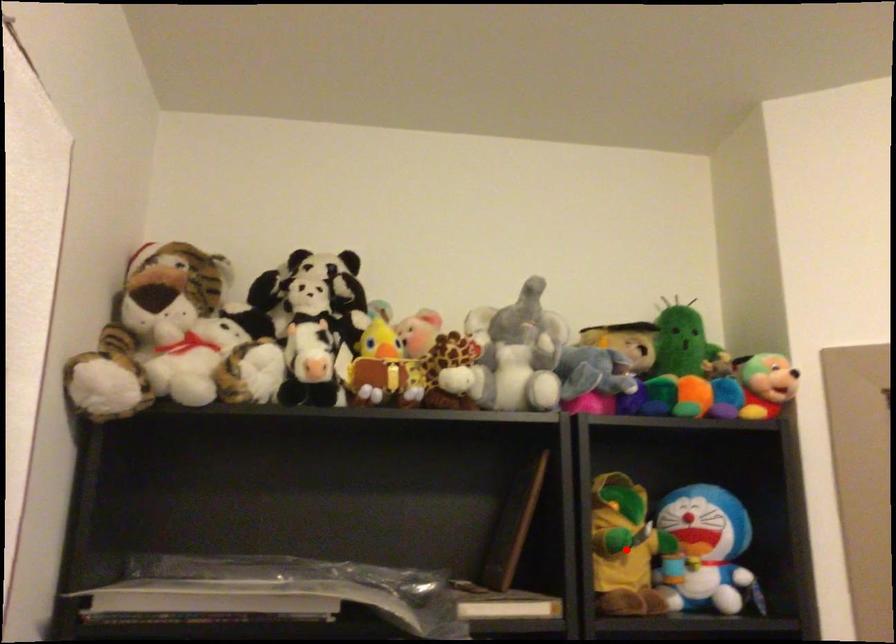
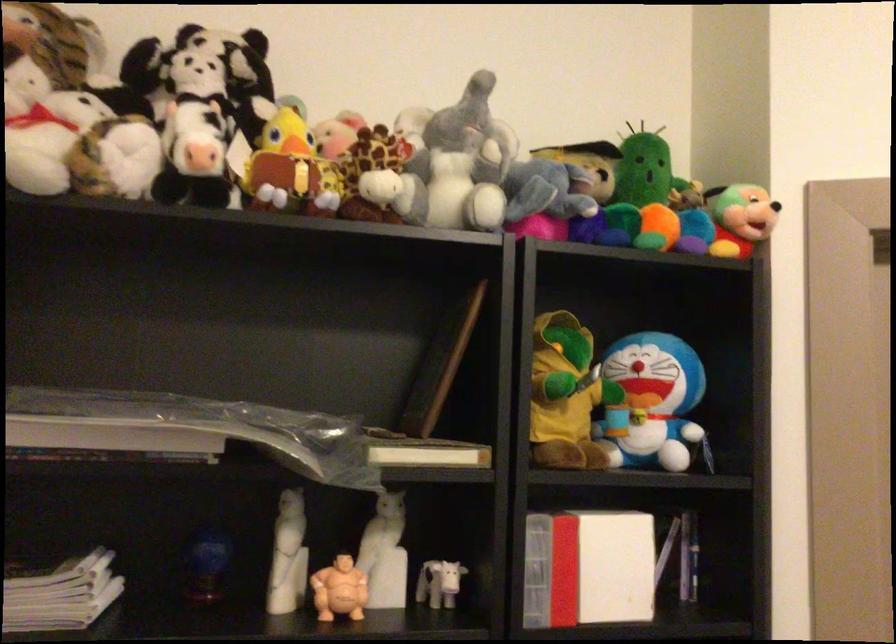
The point at the highlighted location is marked in the first image. Where is the corresponding point in the second image?

(565, 395)